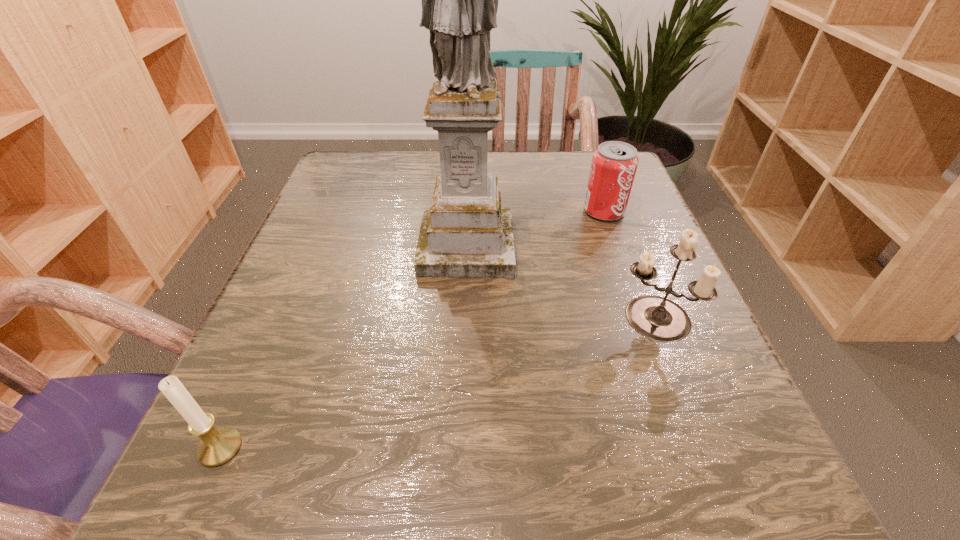
Where is `free spot located on the right of the leftmost object`? free spot located on the right of the leftmost object is located at coordinates (525, 448).

The width and height of the screenshot is (960, 540). I want to click on object present at the far edge, so tap(614, 164).

This screenshot has width=960, height=540. I want to click on object at the near edge, so click(217, 446).

The width and height of the screenshot is (960, 540). What are the coordinates of `object at the left edge` in the screenshot? It's located at (217, 446).

Locate an element on the screen. candle holder that is at the right edge is located at coordinates (657, 318).

Locate an element on the screen. This screenshot has height=540, width=960. soda can located in the right edge section of the desktop is located at coordinates (614, 164).

I want to click on object present at the near left corner, so click(217, 446).

What are the coordinates of `object positioned at the far right corner` in the screenshot? It's located at (614, 164).

Where is `free space at the far edge of the desktop`? The image size is (960, 540). free space at the far edge of the desktop is located at coordinates (491, 161).

In the image, there is a desktop. At what (x,y) coordinates should I click in order to perform the action: click on vacant space at the near edge. Please return your answer as a coordinate pair (x, y). The image size is (960, 540). Looking at the image, I should click on (332, 458).